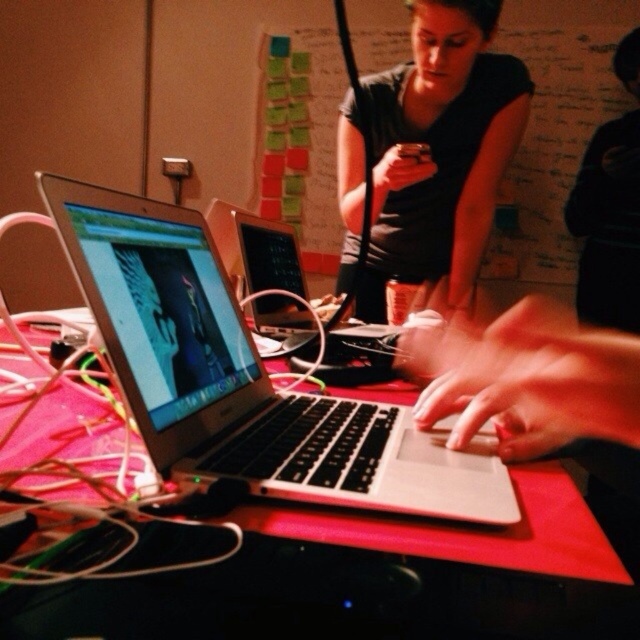
Question: Does silver/black laptop at center have a lesser width compared to matte black shirt at center?

Choices:
 (A) yes
 (B) no

Answer: (A)

Question: Which object appears farthest from the camera in this image?

Choices:
 (A) smooth skin hands at center
 (B) matte black shirt at center
 (C) silver/black laptop at center

Answer: (B)

Question: Which point is closer to the camera taking this photo?

Choices:
 (A) (301, 324)
 (B) (586, 326)

Answer: (A)

Question: Is silver/black laptop at center to the right of black fabric shirt at upper center from the viewer's perspective?

Choices:
 (A) no
 (B) yes

Answer: (A)

Question: Which of the following is the farthest from the observer?

Choices:
 (A) (598, 221)
 (B) (486, 170)
 (C) (163, 211)

Answer: (A)

Question: Is smooth skin hands at center behind black fabric shirt at upper center?

Choices:
 (A) yes
 (B) no

Answer: (B)